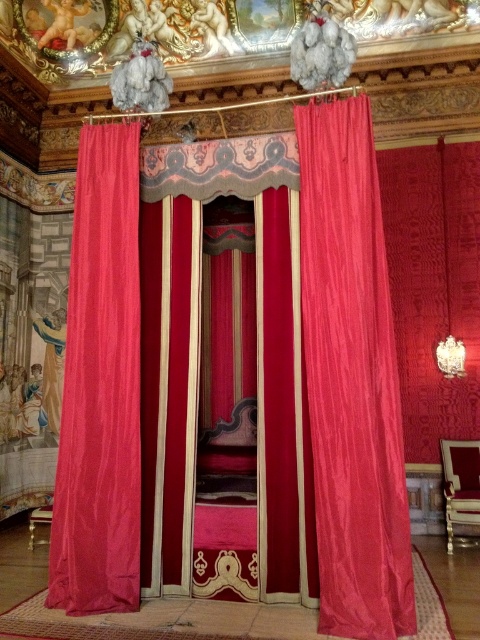
Measure the distance between point (372, 307) and camera.

They are 13.16 feet apart.

In the scene shown: Which is more to the right, velvet pink curtain at center or silky pink curtain at left?

velvet pink curtain at center

Identify the location of velvet pink curtain at center. (351, 378).

Is point (259, 422) positioned behind point (124, 509)?

Yes.

Does point (192, 308) come closer to viewer compared to point (131, 435)?

No, (192, 308) is further to viewer.

Is point (144, 481) closer to camera compared to point (75, 582)?

No, (144, 481) is further to viewer.

Locate an element on the screen. velvet bed at center is located at coordinates (240, 385).

Can you confirm if velvet bed at center is positioned below velvet pink curtain at center?

Yes.

Between velvet bed at center and velvet pink curtain at center, which one appears on the right side from the viewer's perspective?

velvet pink curtain at center

This screenshot has height=640, width=480. Identify the location of velvet bed at center. (240, 385).

Where is `velvet bed at center`? This screenshot has height=640, width=480. velvet bed at center is located at coordinates (240, 385).